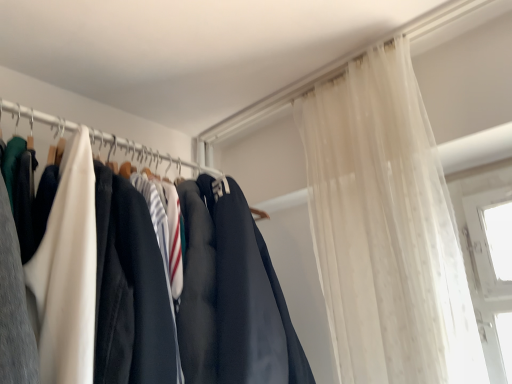
From the picture: Measure the distance between sheer white curtain at upper right and camera.

sheer white curtain at upper right is 35.53 inches from camera.

Find the location of a particular element. This screenshot has height=384, width=512. sheer white curtain at upper right is located at coordinates (386, 228).

Image resolution: width=512 pixels, height=384 pixels. What do you see at coordinates (386, 228) in the screenshot? I see `sheer white curtain at upper right` at bounding box center [386, 228].

The height and width of the screenshot is (384, 512). What are the coordinates of `matte black clothing at left` in the screenshot? It's located at (146, 153).

What do you see at coordinates (146, 153) in the screenshot?
I see `matte black clothing at left` at bounding box center [146, 153].

Where is `sheer white curtain at upper right`? The height and width of the screenshot is (384, 512). sheer white curtain at upper right is located at coordinates (386, 228).

Based on the photo, between sheer white curtain at upper right and matte black clothing at left, which one appears on the right side from the viewer's perspective?

sheer white curtain at upper right.

Is sheer white curtain at upper right further to camera compared to matte black clothing at left?

No, sheer white curtain at upper right is closer to the camera.

Is point (392, 315) positioned after point (74, 123)?

That is True.

From the image's perspective, is sheer white curtain at upper right positioned above or below matte black clothing at left?

Based on their image positions, sheer white curtain at upper right is located beneath matte black clothing at left.

From a real-world perspective, between sheer white curtain at upper right and matte black clothing at left, who is vertically lower?

sheer white curtain at upper right is physically lower.

Considering the relative sizes of sheer white curtain at upper right and matte black clothing at left in the image provided, is sheer white curtain at upper right thinner than matte black clothing at left?

Incorrect, the width of sheer white curtain at upper right is not less than that of matte black clothing at left.

Considering the relative sizes of sheer white curtain at upper right and matte black clothing at left in the image provided, is sheer white curtain at upper right taller than matte black clothing at left?

Yes, sheer white curtain at upper right is taller than matte black clothing at left.

Considering the relative sizes of sheer white curtain at upper right and matte black clothing at left in the image provided, is sheer white curtain at upper right smaller than matte black clothing at left?

Incorrect, sheer white curtain at upper right is not smaller in size than matte black clothing at left.

Is sheer white curtain at upper right located outside matte black clothing at left?

sheer white curtain at upper right is positioned outside matte black clothing at left.

Is sheer white curtain at upper right far from matte black clothing at left?

No, sheer white curtain at upper right is not far away from matte black clothing at left.

Is matte black clothing at left at the back of sheer white curtain at upper right?

sheer white curtain at upper right does not have its back to matte black clothing at left.

How far apart are sheer white curtain at upper right and matte black clothing at left?

sheer white curtain at upper right is 21.13 inches away from matte black clothing at left.

This screenshot has height=384, width=512. I want to click on clothesline behind the sheer white curtain at upper right, so click(146, 153).

Visually, is matte black clothing at left positioned to the left or to the right of sheer white curtain at upper right?

matte black clothing at left is positioned on sheer white curtain at upper right's left side.

Who is more distant, matte black clothing at left or sheer white curtain at upper right?

matte black clothing at left is more distant.

Which is less distant, [122,141] or [441,169]?

Positioned in front is point [441,169].

In the scene shown: From the image's perspective, is matte black clothing at left above or below sheer white curtain at upper right?

From the image's perspective, matte black clothing at left appears above sheer white curtain at upper right.

From a real-world perspective, is matte black clothing at left physically located above or below sheer white curtain at upper right?

From a real-world perspective, matte black clothing at left is physically above sheer white curtain at upper right.

Considering the sizes of objects matte black clothing at left and sheer white curtain at upper right in the image provided, who is wider, matte black clothing at left or sheer white curtain at upper right?

Wider between the two is sheer white curtain at upper right.

Can you confirm if matte black clothing at left is taller than sheer white curtain at upper right?

No.

Between matte black clothing at left and sheer white curtain at upper right, which one has smaller size?

With smaller size is matte black clothing at left.

Is matte black clothing at left surrounding sheer white curtain at upper right?

That's incorrect, sheer white curtain at upper right is not inside matte black clothing at left.

Is matte black clothing at left not close to sheer white curtain at upper right?

That's not correct — matte black clothing at left is a little close to sheer white curtain at upper right.

Is matte black clothing at left looking in the opposite direction of sheer white curtain at upper right?

matte black clothing at left is not turned away from sheer white curtain at upper right.

I want to click on clothesline above the sheer white curtain at upper right (from a real-world perspective), so click(x=146, y=153).

Locate an element on the screen. The height and width of the screenshot is (384, 512). curtain in front of the matte black clothing at left is located at coordinates (386, 228).

Find the location of `curtain located underneath the matte black clothing at left (from a real-world perspective)`. curtain located underneath the matte black clothing at left (from a real-world perspective) is located at coordinates (386, 228).